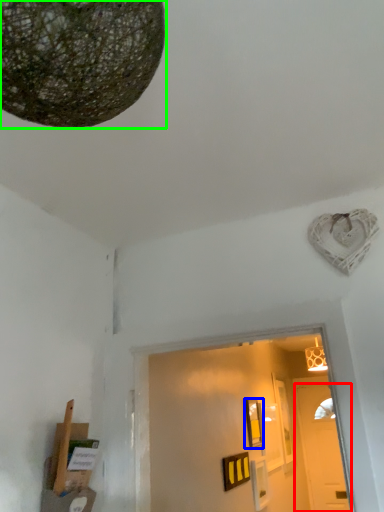
Question: Based on their relative distances, which object is farther from door (highlighted by a red box)? Choose from picture frame (highlighted by a blue box) and lamp (highlighted by a green box).

Choices:
 (A) picture frame
 (B) lamp

Answer: (B)